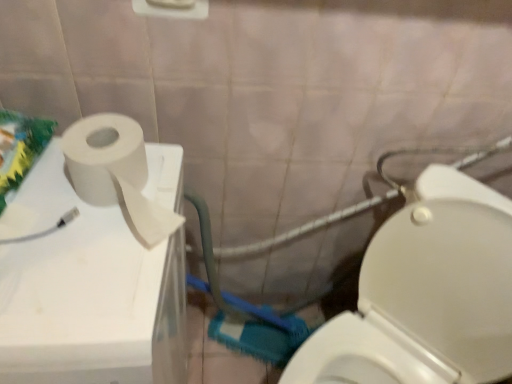
Question: From the image's perspective, would you say white matte toilet paper at left is shown under white glossy toilet at lower right?

Choices:
 (A) yes
 (B) no

Answer: (B)

Question: Is white matte toilet paper at left at the left side of white glossy toilet at lower right?

Choices:
 (A) yes
 (B) no

Answer: (A)

Question: Does white matte toilet paper at left have a smaller size compared to white glossy toilet at lower right?

Choices:
 (A) yes
 (B) no

Answer: (A)

Question: From a real-world perspective, is white matte toilet paper at left below white glossy toilet at lower right?

Choices:
 (A) no
 (B) yes

Answer: (A)

Question: Could you tell me if white matte toilet paper at left is facing white glossy toilet at lower right?

Choices:
 (A) yes
 (B) no

Answer: (B)

Question: Visually, is white matte toilet paper at left positioned to the left or to the right of white matte toilet paper at upper left?

Choices:
 (A) right
 (B) left

Answer: (A)

Question: In terms of size, does white matte toilet paper at left appear bigger or smaller than white matte toilet paper at upper left?

Choices:
 (A) small
 (B) big

Answer: (A)

Question: From the image's perspective, relative to white matte toilet paper at upper left, is white matte toilet paper at left above or below?

Choices:
 (A) above
 (B) below

Answer: (A)

Question: From their relative heights in the image, would you say white matte toilet paper at left is taller or shorter than white matte toilet paper at upper left?

Choices:
 (A) short
 (B) tall

Answer: (A)

Question: Is white matte toilet paper at upper left situated inside white matte toilet paper at left or outside?

Choices:
 (A) outside
 (B) inside

Answer: (A)

Question: Based on their positions, is white matte toilet paper at upper left located to the left or right of white matte toilet paper at left?

Choices:
 (A) left
 (B) right

Answer: (A)

Question: From the image's perspective, is white matte toilet paper at upper left located above or below white matte toilet paper at left?

Choices:
 (A) above
 (B) below

Answer: (B)

Question: From a real-world perspective, is white matte toilet paper at upper left above or below white matte toilet paper at left?

Choices:
 (A) below
 (B) above

Answer: (A)

Question: From a real-world perspective, is white matte toilet paper at upper left physically located above or below white glossy toilet at lower right?

Choices:
 (A) below
 (B) above

Answer: (B)

Question: Is white matte toilet paper at upper left bigger or smaller than white glossy toilet at lower right?

Choices:
 (A) small
 (B) big

Answer: (B)